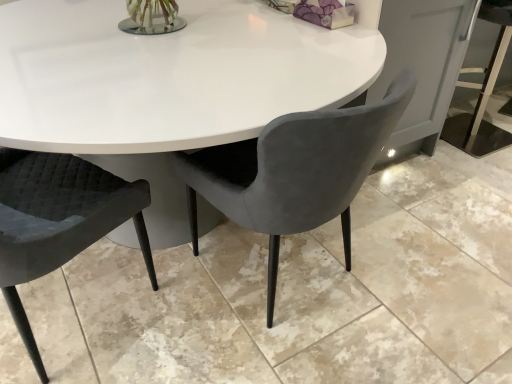
You are a GUI agent. You are given a task and a screenshot of the screen. Output one action in this format:
    pyautogui.click(x=<x>, y=<y>)
    Task: Click on the velvet grey chair at center, acting as the second chair starting from the left
    
    Given the screenshot: What is the action you would take?
    pyautogui.click(x=295, y=171)

The width and height of the screenshot is (512, 384). Describe the element at coordinates (295, 171) in the screenshot. I see `velvet grey chair at center, which appears as the first chair when viewed from the right` at that location.

You are a GUI agent. You are given a task and a screenshot of the screen. Output one action in this format:
    pyautogui.click(x=<x>, y=<y>)
    Task: Click on the quilted black chair at lower left, the 1th chair when ordered from left to right
    
    Given the screenshot: What is the action you would take?
    pyautogui.click(x=58, y=221)

Measure the distance between point (49, 210) and camera.

3.87 feet.

Describe the element at coordinates (58, 221) in the screenshot. I see `quilted black chair at lower left, which is the 2th chair from right to left` at that location.

What are the coordinates of `velvet grey chair at center, acting as the second chair starting from the left` in the screenshot? It's located at (295, 171).

Considering the relative positions of quilted black chair at lower left, which is the 2th chair from right to left, and velvet grey chair at center, which appears as the first chair when viewed from the right, in the image provided, is quilted black chair at lower left, which is the 2th chair from right to left, to the right of velvet grey chair at center, which appears as the first chair when viewed from the right, from the viewer's perspective?

Incorrect, quilted black chair at lower left, which is the 2th chair from right to left, is not on the right side of velvet grey chair at center, which appears as the first chair when viewed from the right.

Is quilted black chair at lower left, which is the 2th chair from right to left, in front of or behind velvet grey chair at center, which appears as the first chair when viewed from the right, in the image?

quilted black chair at lower left, which is the 2th chair from right to left, is positioned closer to the viewer than velvet grey chair at center, which appears as the first chair when viewed from the right.

Which is behind, point (4, 253) or point (255, 167)?

Positioned behind is point (255, 167).

From the image's perspective, between quilted black chair at lower left, which is the 2th chair from right to left, and velvet grey chair at center, which appears as the first chair when viewed from the right, who is located below?

quilted black chair at lower left, which is the 2th chair from right to left.

From a real-world perspective, who is located lower, quilted black chair at lower left, the 1th chair when ordered from left to right, or velvet grey chair at center, which appears as the first chair when viewed from the right?

In real-world perspective, velvet grey chair at center, which appears as the first chair when viewed from the right, is lower.

Is quilted black chair at lower left, which is the 2th chair from right to left, thinner than velvet grey chair at center, acting as the second chair starting from the left?

Correct, the width of quilted black chair at lower left, which is the 2th chair from right to left, is less than that of velvet grey chair at center, acting as the second chair starting from the left.

Who is taller, quilted black chair at lower left, which is the 2th chair from right to left, or velvet grey chair at center, which appears as the first chair when viewed from the right?

quilted black chair at lower left, which is the 2th chair from right to left, is taller.

Considering the relative sizes of quilted black chair at lower left, which is the 2th chair from right to left, and velvet grey chair at center, acting as the second chair starting from the left, in the image provided, is quilted black chair at lower left, which is the 2th chair from right to left, smaller than velvet grey chair at center, acting as the second chair starting from the left,?

Correct, quilted black chair at lower left, which is the 2th chair from right to left, occupies less space than velvet grey chair at center, acting as the second chair starting from the left.

Is quilted black chair at lower left, the 1th chair when ordered from left to right, surrounding velvet grey chair at center, acting as the second chair starting from the left?

Actually, velvet grey chair at center, acting as the second chair starting from the left, is outside quilted black chair at lower left, the 1th chair when ordered from left to right.

Is quilted black chair at lower left, which is the 2th chair from right to left, next to velvet grey chair at center, which appears as the first chair when viewed from the right?

quilted black chair at lower left, which is the 2th chair from right to left, and velvet grey chair at center, which appears as the first chair when viewed from the right, are clearly separated.

Does quilted black chair at lower left, the 1th chair when ordered from left to right, turn towards velvet grey chair at center, acting as the second chair starting from the left?

No, quilted black chair at lower left, the 1th chair when ordered from left to right, is not oriented towards velvet grey chair at center, acting as the second chair starting from the left.

What's the angular difference between quilted black chair at lower left, which is the 2th chair from right to left, and velvet grey chair at center, acting as the second chair starting from the left,'s facing directions?

79.3 degrees.

How much distance is there between quilted black chair at lower left, the 1th chair when ordered from left to right, and velvet grey chair at center, acting as the second chair starting from the left?

quilted black chair at lower left, the 1th chair when ordered from left to right, is 41.79 centimeters away from velvet grey chair at center, acting as the second chair starting from the left.

Where is `chair above the velvet grey chair at center, acting as the second chair starting from the left (from a real-world perspective)`? Image resolution: width=512 pixels, height=384 pixels. chair above the velvet grey chair at center, acting as the second chair starting from the left (from a real-world perspective) is located at coordinates (58, 221).

Is velvet grey chair at center, which appears as the first chair when viewed from the right, at the right side of quilted black chair at lower left, which is the 2th chair from right to left?

Yes, velvet grey chair at center, which appears as the first chair when viewed from the right, is to the right of quilted black chair at lower left, which is the 2th chair from right to left.

Which object is closer to the camera taking this photo, velvet grey chair at center, which appears as the first chair when viewed from the right, or quilted black chair at lower left, the 1th chair when ordered from left to right?

quilted black chair at lower left, the 1th chair when ordered from left to right.

Is point (291, 143) in front of point (20, 241)?

Yes, it is in front of point (20, 241).

From the image's perspective, which is below, velvet grey chair at center, which appears as the first chair when viewed from the right, or quilted black chair at lower left, which is the 2th chair from right to left?

quilted black chair at lower left, which is the 2th chair from right to left, appears lower in the image.

From a real-world perspective, which is physically below, velvet grey chair at center, acting as the second chair starting from the left, or quilted black chair at lower left, which is the 2th chair from right to left?

From a 3D spatial view, velvet grey chair at center, acting as the second chair starting from the left, is below.

Which of these two, velvet grey chair at center, acting as the second chair starting from the left, or quilted black chair at lower left, which is the 2th chair from right to left, is thinner?

quilted black chair at lower left, which is the 2th chair from right to left, is thinner.

Which of these two, velvet grey chair at center, which appears as the first chair when viewed from the right, or quilted black chair at lower left, which is the 2th chair from right to left, stands shorter?

velvet grey chair at center, which appears as the first chair when viewed from the right.

Is velvet grey chair at center, which appears as the first chair when viewed from the right, bigger or smaller than quilted black chair at lower left, which is the 2th chair from right to left?

velvet grey chair at center, which appears as the first chair when viewed from the right, is bigger than quilted black chair at lower left, which is the 2th chair from right to left.

Is velvet grey chair at center, which appears as the first chair when viewed from the right, outside of quilted black chair at lower left, which is the 2th chair from right to left?

Absolutely, velvet grey chair at center, which appears as the first chair when viewed from the right, is external to quilted black chair at lower left, which is the 2th chair from right to left.

Is velvet grey chair at center, which appears as the first chair when viewed from the right, touching quilted black chair at lower left, which is the 2th chair from right to left?

No, velvet grey chair at center, which appears as the first chair when viewed from the right, is not touching quilted black chair at lower left, which is the 2th chair from right to left.

Is velvet grey chair at center, which appears as the first chair when viewed from the right, facing away from quilted black chair at lower left, which is the 2th chair from right to left?

No, velvet grey chair at center, which appears as the first chair when viewed from the right,'s orientation is not away from quilted black chair at lower left, which is the 2th chair from right to left.

Can you tell me how much velvet grey chair at center, acting as the second chair starting from the left, and quilted black chair at lower left, which is the 2th chair from right to left, differ in facing direction?

79.3 degrees separate the facing orientations of velvet grey chair at center, acting as the second chair starting from the left, and quilted black chair at lower left, which is the 2th chair from right to left.

Identify the location of chair located above the velvet grey chair at center, which appears as the first chair when viewed from the right (from a real-world perspective). (58, 221).

Locate an element on the screen. chair located above the quilted black chair at lower left, which is the 2th chair from right to left (from the image's perspective) is located at coordinates (295, 171).

Where is `chair below the velvet grey chair at center, which appears as the first chair when viewed from the right (from the image's perspective)`? The height and width of the screenshot is (384, 512). chair below the velvet grey chair at center, which appears as the first chair when viewed from the right (from the image's perspective) is located at coordinates (58, 221).